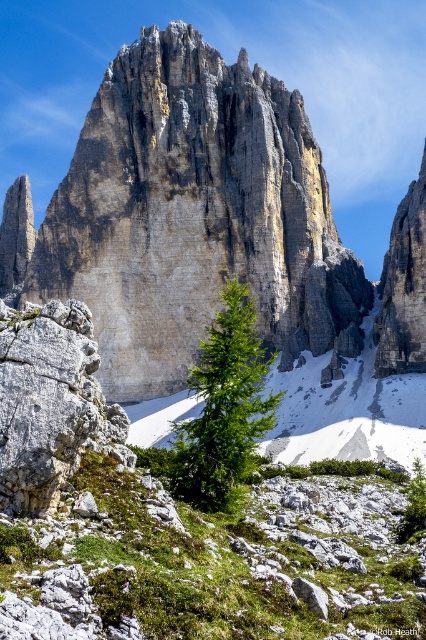
Question: Which of the following is the farthest from the observer?

Choices:
 (A) (48, 420)
 (B) (189, 493)

Answer: (B)

Question: Which point appears farthest from the camera in this image?

Choices:
 (A) (261, 212)
 (B) (215, 321)
 (C) (58, 451)

Answer: (A)

Question: Considering the real-world distances, which object is closest to the gray rough rock at lower left?

Choices:
 (A) green matte tree at center
 (B) gray stone mountain at center

Answer: (A)

Question: Does gray rough rock at lower left come behind green matte tree at center?

Choices:
 (A) no
 (B) yes

Answer: (A)

Question: Does gray rough rock at lower left appear on the right side of green matte tree at center?

Choices:
 (A) yes
 (B) no

Answer: (B)

Question: Considering the relative positions of gray rough rock at lower left and green matte tree at center in the image provided, where is gray rough rock at lower left located with respect to green matte tree at center?

Choices:
 (A) right
 (B) left

Answer: (B)